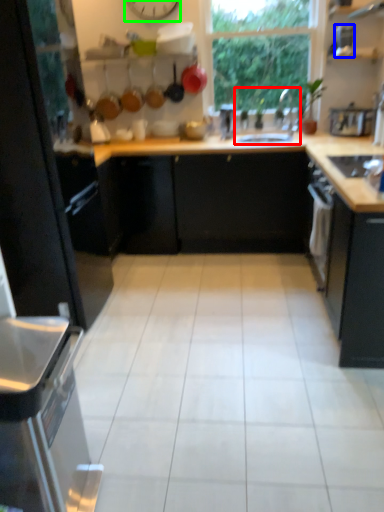
Question: Which object is the closest to the sink (highlighted by a red box)? Choose among these: appliance (highlighted by a blue box) or clock (highlighted by a green box).

Choices:
 (A) appliance
 (B) clock

Answer: (A)